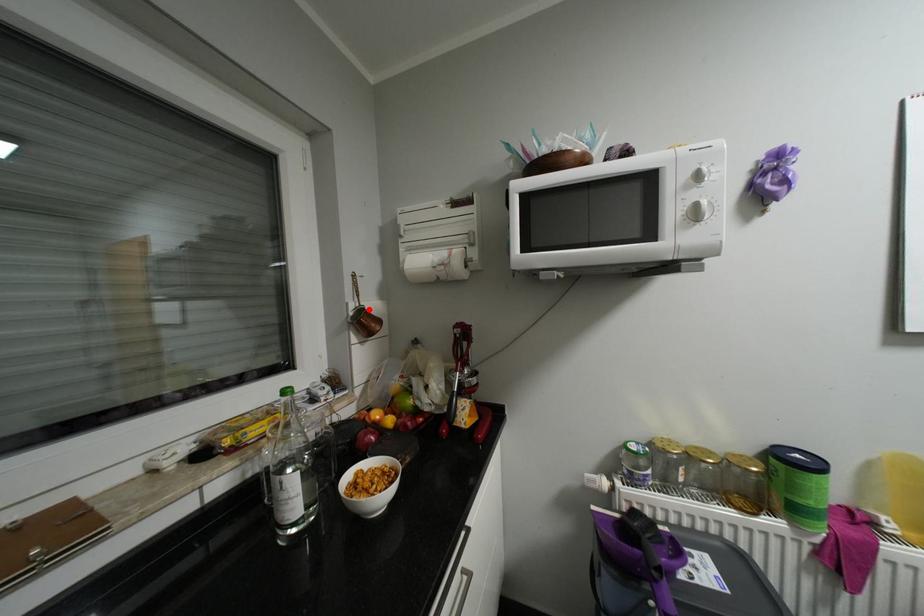
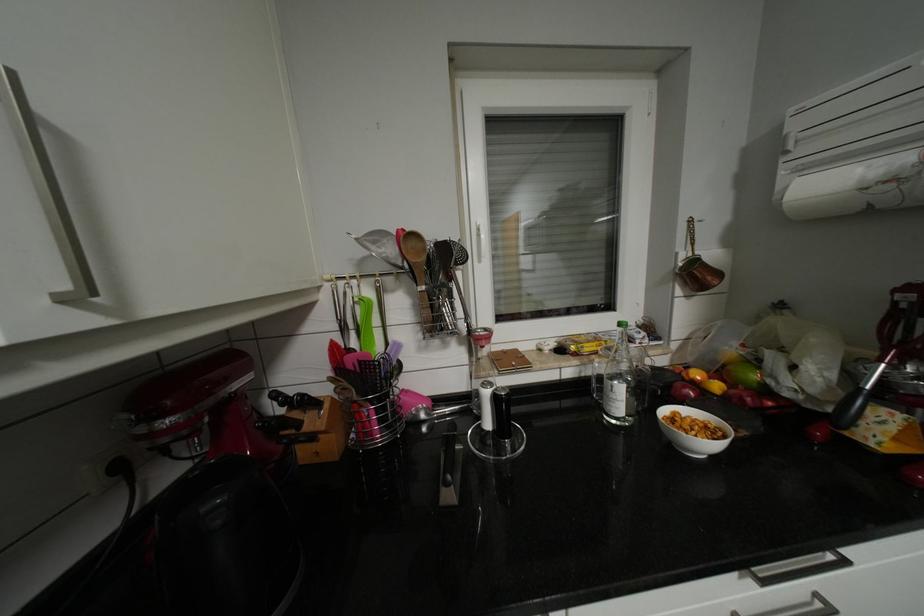
Find the pixel in the second image that matches the highlighted location in the first image.

(702, 261)